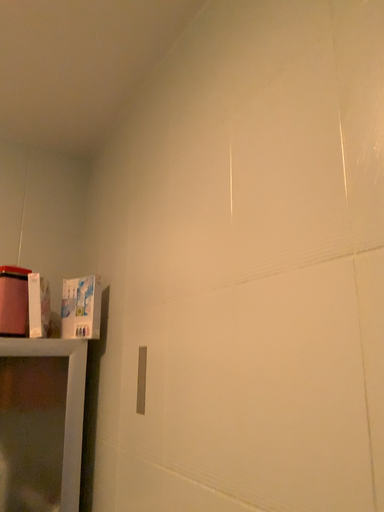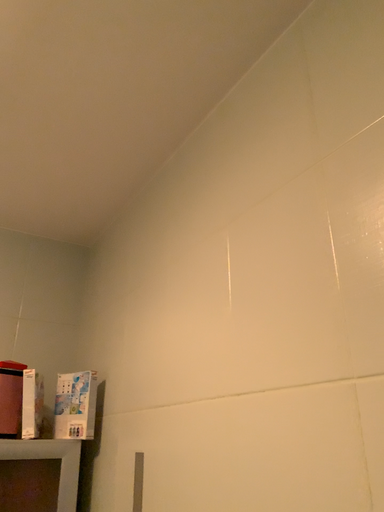
Question: Which way did the camera rotate in the video?

Choices:
 (A) rotated upward
 (B) rotated downward

Answer: (A)